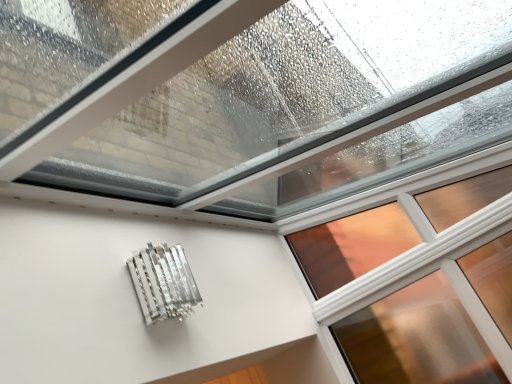
Question: Considering the relative sizes of metallic silver at lower left and clear glass window at upper center in the image provided, is metallic silver at lower left smaller than clear glass window at upper center?

Choices:
 (A) yes
 (B) no

Answer: (A)

Question: From the image's perspective, is metallic silver at lower left located above clear glass window at upper center?

Choices:
 (A) yes
 (B) no

Answer: (B)

Question: Does metallic silver at lower left turn towards clear glass window at upper center?

Choices:
 (A) yes
 (B) no

Answer: (B)

Question: Is metallic silver at lower left positioned before clear glass window at upper center?

Choices:
 (A) yes
 (B) no

Answer: (A)

Question: Considering the relative positions of metallic silver at lower left and clear glass window at upper center in the image provided, is metallic silver at lower left to the right of clear glass window at upper center from the viewer's perspective?

Choices:
 (A) yes
 (B) no

Answer: (B)

Question: From a real-world perspective, is metallic silver at lower left on clear glass window at upper center?

Choices:
 (A) yes
 (B) no

Answer: (A)

Question: Is metallic silver at lower left inside clear glass window at upper center?

Choices:
 (A) no
 (B) yes

Answer: (A)

Question: From the image's perspective, does clear glass window at upper center appear lower than metallic silver at lower left?

Choices:
 (A) no
 (B) yes

Answer: (A)

Question: Does clear glass window at upper center have a lesser height compared to metallic silver at lower left?

Choices:
 (A) yes
 (B) no

Answer: (B)

Question: From a real-world perspective, is clear glass window at upper center physically below metallic silver at lower left?

Choices:
 (A) no
 (B) yes

Answer: (B)

Question: Is clear glass window at upper center further to the viewer compared to metallic silver at lower left?

Choices:
 (A) yes
 (B) no

Answer: (A)

Question: Is clear glass window at upper center to the right of metallic silver at lower left from the viewer's perspective?

Choices:
 (A) yes
 (B) no

Answer: (A)

Question: Considering the positions of point (166, 301) and point (408, 240), is point (166, 301) closer or farther from the camera than point (408, 240)?

Choices:
 (A) farther
 (B) closer

Answer: (B)